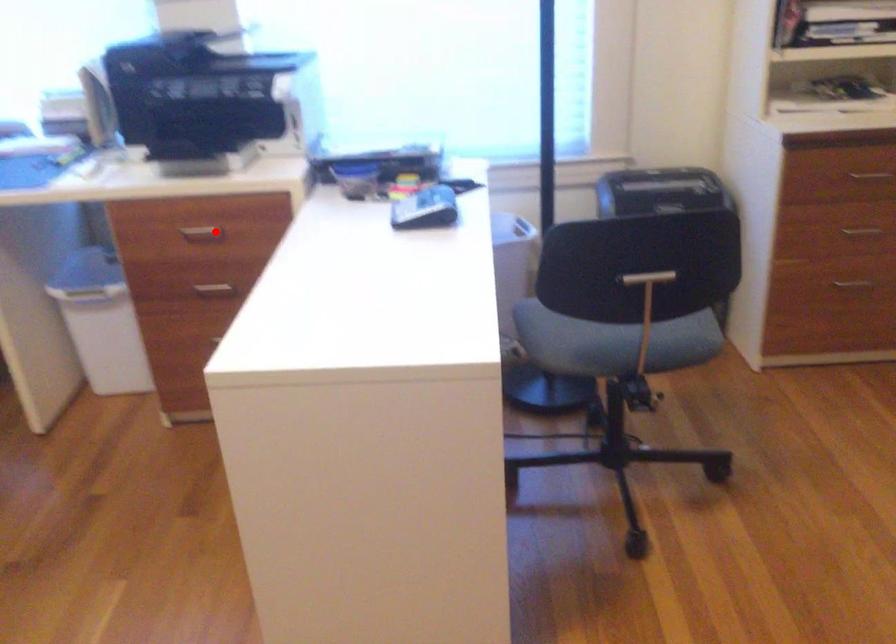
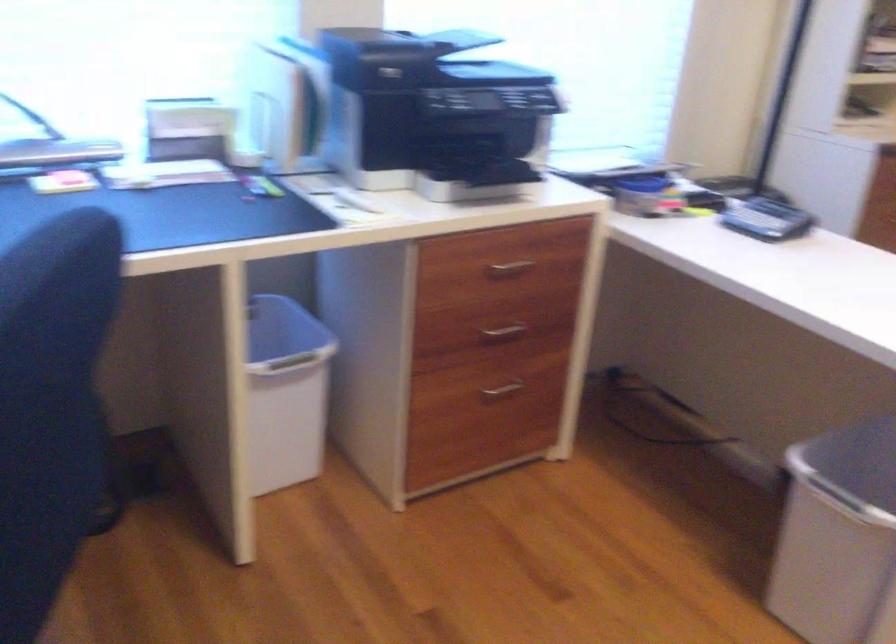
The point at the highlighted location is marked in the first image. Where is the corresponding point in the second image?

(510, 268)